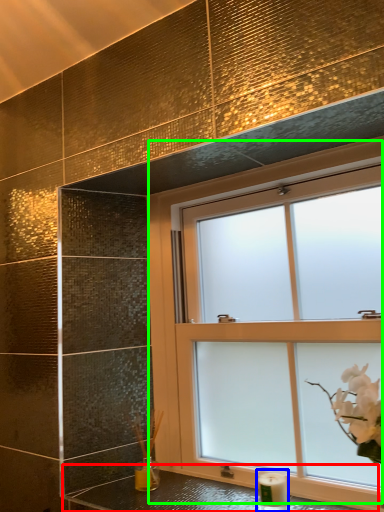
Question: Which is nearer to the counter top (highlighted by a red box)? candle holder (highlighted by a blue box) or window (highlighted by a green box).

Choices:
 (A) candle holder
 (B) window

Answer: (A)